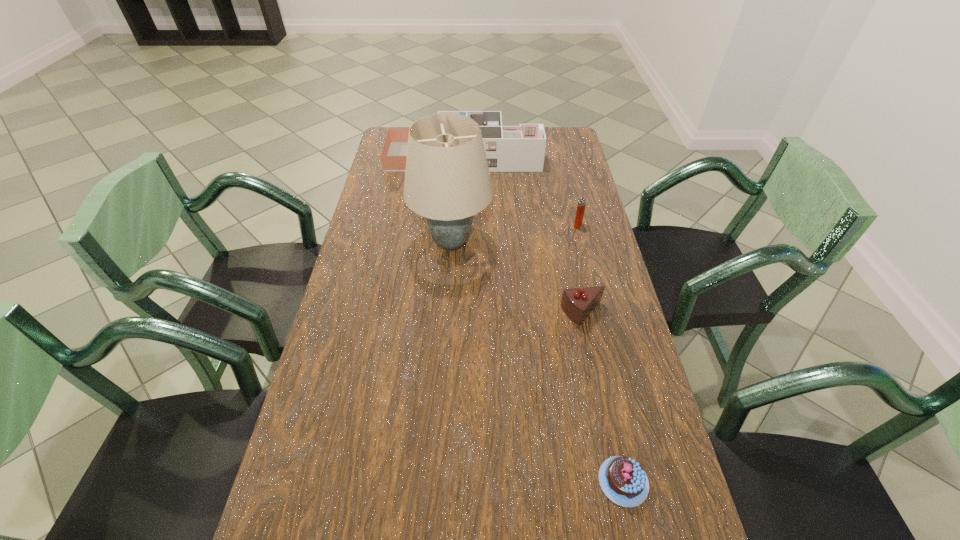
In the image, there is a desktop. Identify the location of blank space at the right edge. (553, 196).

This screenshot has height=540, width=960. I want to click on free space between the shortest object and the third tallest object, so click(600, 353).

In order to click on vacant space that is in between the fourth tallest object and the nearest object in this screenshot , I will do `click(603, 397)`.

The height and width of the screenshot is (540, 960). What are the coordinates of `free space between the fourth tallest object and the igniter` in the screenshot? It's located at (580, 269).

Where is `free space between the dollhouse and the shortest object`? This screenshot has width=960, height=540. free space between the dollhouse and the shortest object is located at coordinates (543, 319).

You are a GUI agent. You are given a task and a screenshot of the screen. Output one action in this format:
    pyautogui.click(x=<x>, y=<y>)
    Task: Click on the free space between the fourth tallest object and the dollhouse
    
    Given the screenshot: What is the action you would take?
    pyautogui.click(x=523, y=235)

You are a GUI agent. You are given a task and a screenshot of the screen. Output one action in this format:
    pyautogui.click(x=<x>, y=<y>)
    Task: Click on the free space between the third tallest object and the lampshade
    Image resolution: width=960 pixels, height=540 pixels.
    Given the screenshot: What is the action you would take?
    pyautogui.click(x=515, y=234)

This screenshot has height=540, width=960. I want to click on free space between the taller chocolate cake and the tallest object, so click(x=517, y=278).

Find the location of `vacant area between the third shortest object and the farthest object`. vacant area between the third shortest object and the farthest object is located at coordinates (520, 191).

The width and height of the screenshot is (960, 540). I want to click on the fourth closest object to the igniter, so click(x=622, y=479).